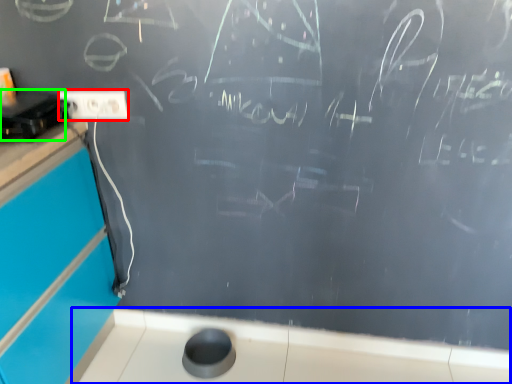
Question: Estimate the real-world distances between objects in this image. Which object is farther from electric outlet (highlighted by a red box), counter top (highlighted by a blue box) or appliance (highlighted by a green box)?

Choices:
 (A) counter top
 (B) appliance

Answer: (A)